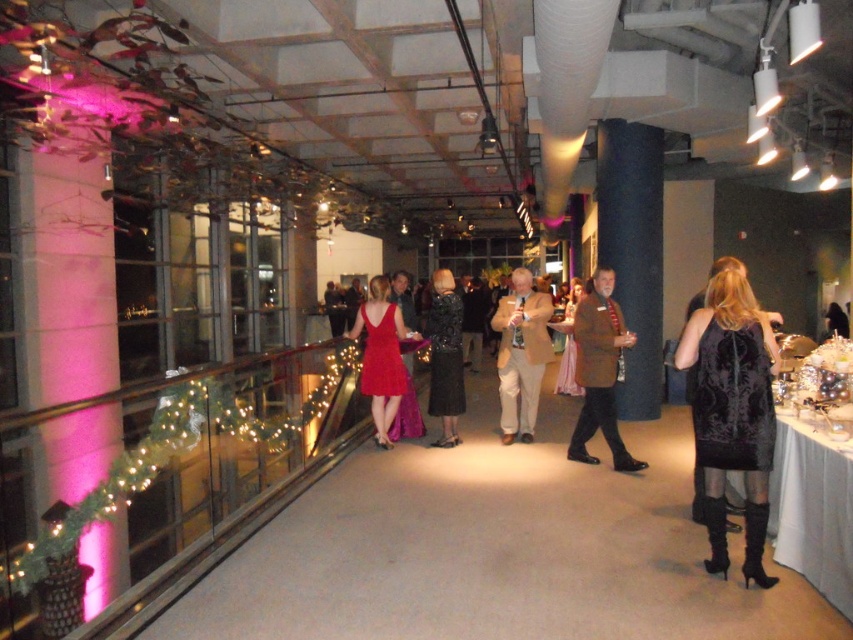
You are a guest at the event and want to hang your velvet black dress at right and brown textured coat at center on a coat rack. The coat rack has a narrow hook that can only hold items up to 10 cm in thickness. Which item should you hang first to ensure both fit?

The velvet black dress at right is thinner than the brown textured coat at center. Since the hook can only hold up to 10 cm, you should hang the thicker brown textured coat at center first to ensure it fits, then the thinner velvet black dress at right.

Based on the photo, you are a photographer at this event and need to position two guests wearing the velvet black dress at right and the shiny red dress at center for a photo. Based on their current positions, which dress is positioned farther to the right side of the venue?

The velvet black dress at right is positioned farther to the right side of the venue compared to the shiny red dress at center, as it is located to the right of it.